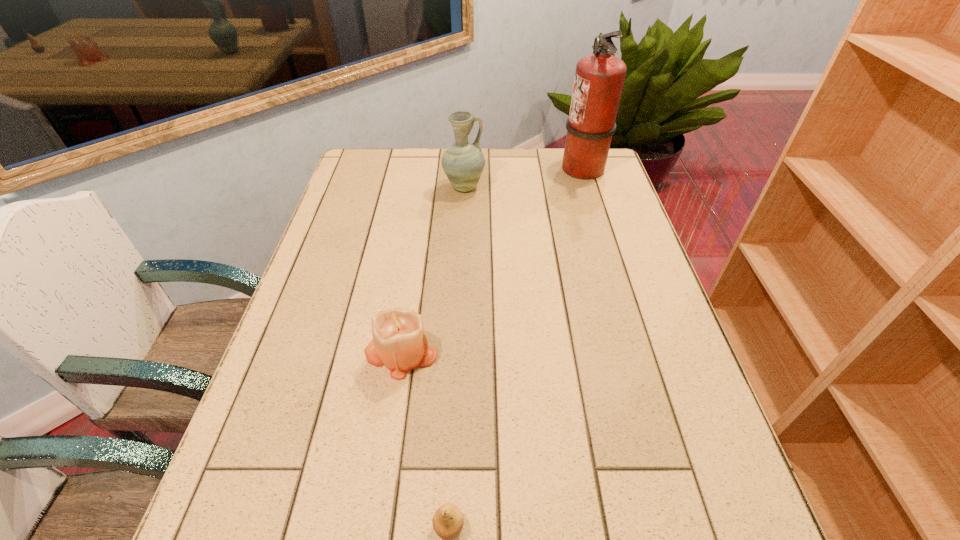
Where is `fire extinguisher`? Image resolution: width=960 pixels, height=540 pixels. fire extinguisher is located at coordinates click(599, 78).

Where is `the rightmost object`? This screenshot has height=540, width=960. the rightmost object is located at coordinates (599, 78).

Locate an element on the screen. the second tallest object is located at coordinates (463, 162).

Image resolution: width=960 pixels, height=540 pixels. I want to click on the second shortest object, so click(399, 342).

Find the location of `the second nearest object`. the second nearest object is located at coordinates (399, 342).

Find the location of a particular element. Image resolution: width=960 pixels, height=540 pixels. vacant region located 0.260m toward the nozzle of the rightmost object is located at coordinates (485, 167).

Identify the location of free spot located toward the nozzle of the rightmost object. This screenshot has width=960, height=540. (528, 167).

At what (x,y) coordinates should I click in order to perform the action: click on blank space located toward the nozzle of the rightmost object. Please return your answer as a coordinate pair (x, y). The height and width of the screenshot is (540, 960). Looking at the image, I should click on (531, 167).

Identify the location of free space located on the handle side of the pitcher. click(567, 187).

Find the location of `vacant region located 0.150m on the left of the third farthest object`. vacant region located 0.150m on the left of the third farthest object is located at coordinates (297, 352).